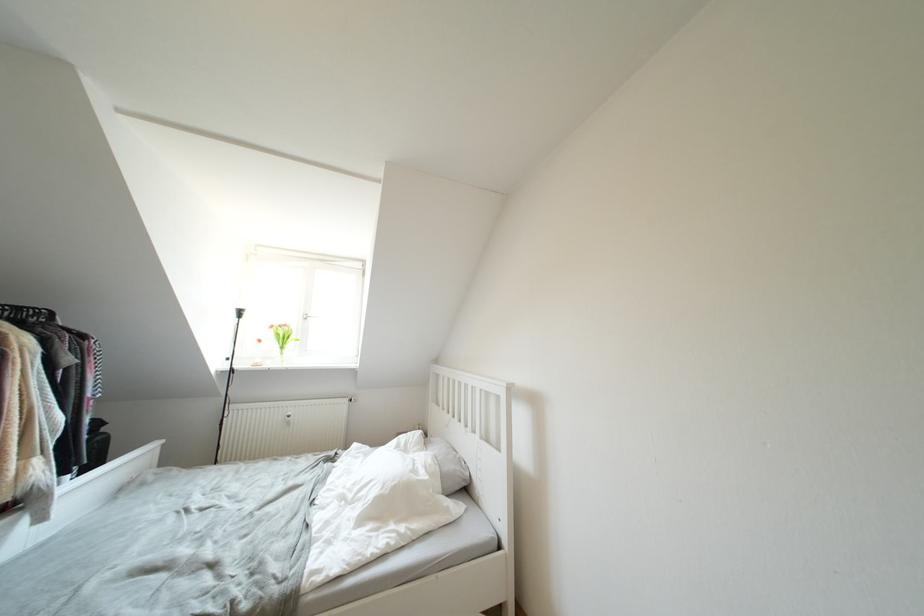
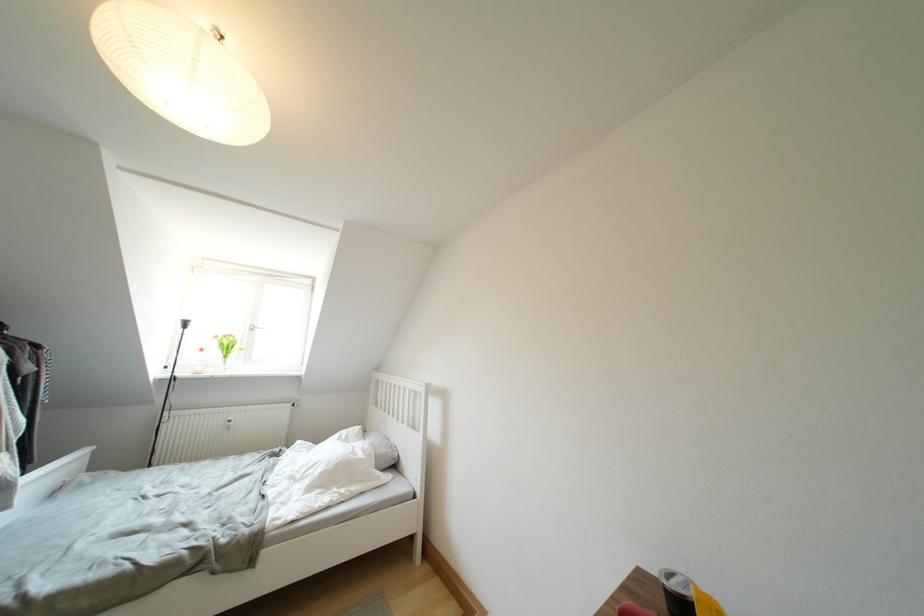
In the second image, find the point that corresponds to [456,471] in the first image.

(388, 454)